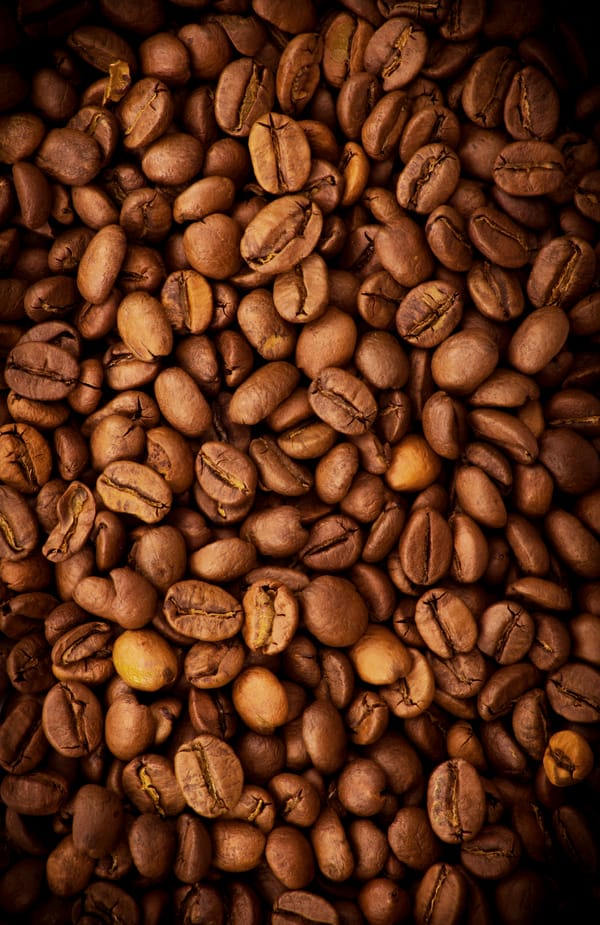
Locate an element on the screen. The height and width of the screenshot is (925, 600). light is located at coordinates [139, 659].